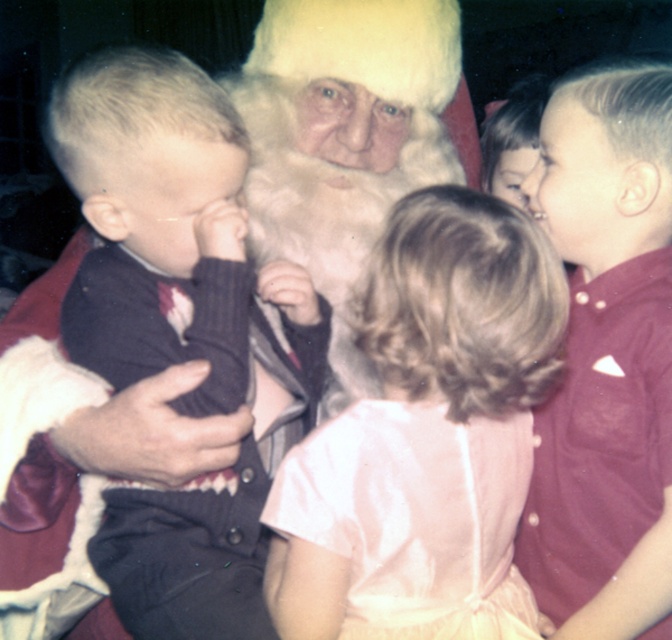
Does pink satin dress at center have a greater height compared to maroon button-up shirt at right?

Incorrect, pink satin dress at center's height is not larger of maroon button-up shirt at right's.

Consider the image. Who is shorter, pink satin dress at center or maroon button-up shirt at right?

pink satin dress at center is shorter.

Does point (456, 211) come closer to viewer compared to point (585, 406)?

Yes, it is.

At what (x,y) coordinates should I click in order to perform the action: click on pink satin dress at center. Please return your answer as a coordinate pair (x, y). Image resolution: width=672 pixels, height=640 pixels. Looking at the image, I should click on (423, 428).

Who is positioned more to the right, dark blue sweater at left or maroon button-up shirt at right?

maroon button-up shirt at right is more to the right.

Which is in front, point (214, 390) or point (566, 240)?

Point (214, 390) is in front.

The height and width of the screenshot is (640, 672). What are the coordinates of `dark blue sweater at left` in the screenshot? It's located at (171, 236).

Between dark blue sweater at left and pink satin dress at center, which one appears on the right side from the viewer's perspective?

From the viewer's perspective, pink satin dress at center appears more on the right side.

Which is in front, point (177, 493) or point (487, 426)?

Point (487, 426)

The height and width of the screenshot is (640, 672). Describe the element at coordinates (171, 236) in the screenshot. I see `dark blue sweater at left` at that location.

Identify the location of dark blue sweater at left. Image resolution: width=672 pixels, height=640 pixels. (171, 236).